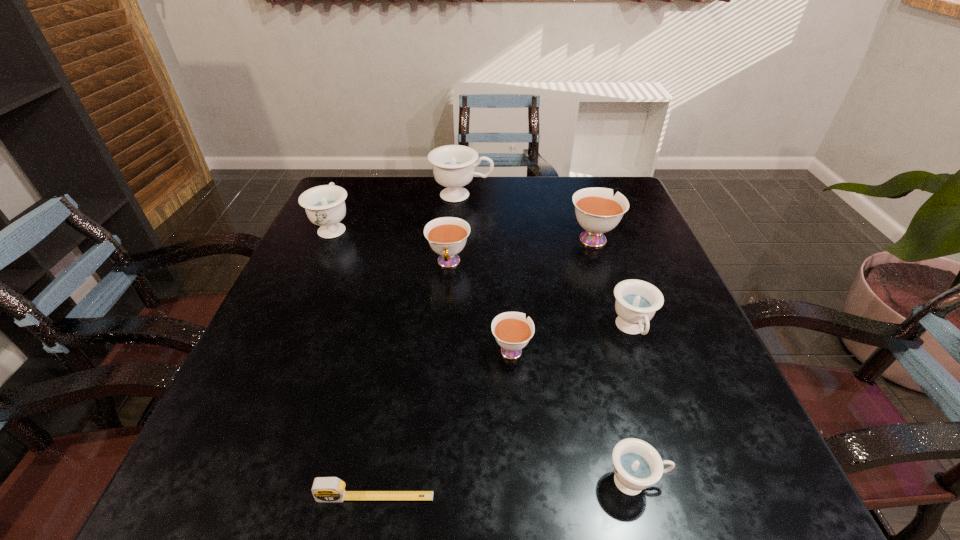
In order to click on vacant space at the right edge of the desktop in this screenshot , I will do `click(617, 251)`.

The width and height of the screenshot is (960, 540). I want to click on vacant space at the far right corner of the desktop, so click(585, 180).

Where is `free space at the near right corner`? The width and height of the screenshot is (960, 540). free space at the near right corner is located at coordinates (721, 504).

Locate an element on the screen. The height and width of the screenshot is (540, 960). vacant space that is in between the third farthest blue teacup and the shortest object is located at coordinates (503, 413).

Where is `free area in between the rightmost white teacup and the second smallest white teacup`? free area in between the rightmost white teacup and the second smallest white teacup is located at coordinates (520, 250).

Where is `free point between the second nearest blue teacup and the second blue teacup from left to right`? free point between the second nearest blue teacup and the second blue teacup from left to right is located at coordinates (546, 262).

The height and width of the screenshot is (540, 960). I want to click on free space between the second blue teacup from left to right and the nearest teacup, so click(549, 338).

You are a GUI agent. You are given a task and a screenshot of the screen. Output one action in this format:
    pyautogui.click(x=<x>, y=<y>)
    Task: Click on the free space that is in between the biggest white teacup and the leftmost white teacup
    The height and width of the screenshot is (540, 960).
    Given the screenshot: What is the action you would take?
    pyautogui.click(x=520, y=250)

Locate an element on the screen. The image size is (960, 540). free point between the nearest teacup and the third farthest blue teacup is located at coordinates (634, 406).

You are a GUI agent. You are given a task and a screenshot of the screen. Output one action in this format:
    pyautogui.click(x=<x>, y=<y>)
    Task: Click on the vacant area that lies between the biggest white teacup and the third blue teacup from right to left
    The image size is (960, 540).
    Given the screenshot: What is the action you would take?
    pyautogui.click(x=527, y=217)